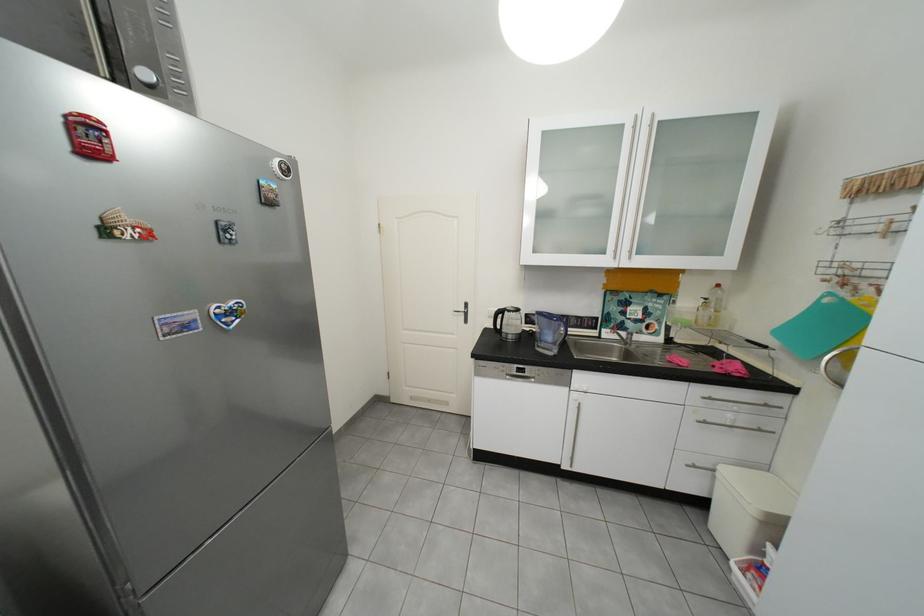
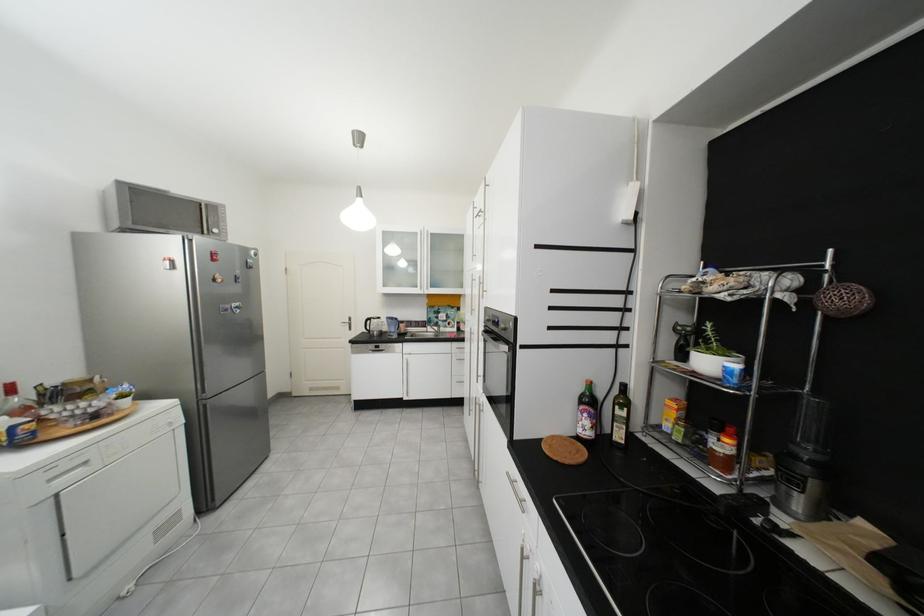
Find the pixel in the second image that matches (513,313) in the first image.

(381, 321)